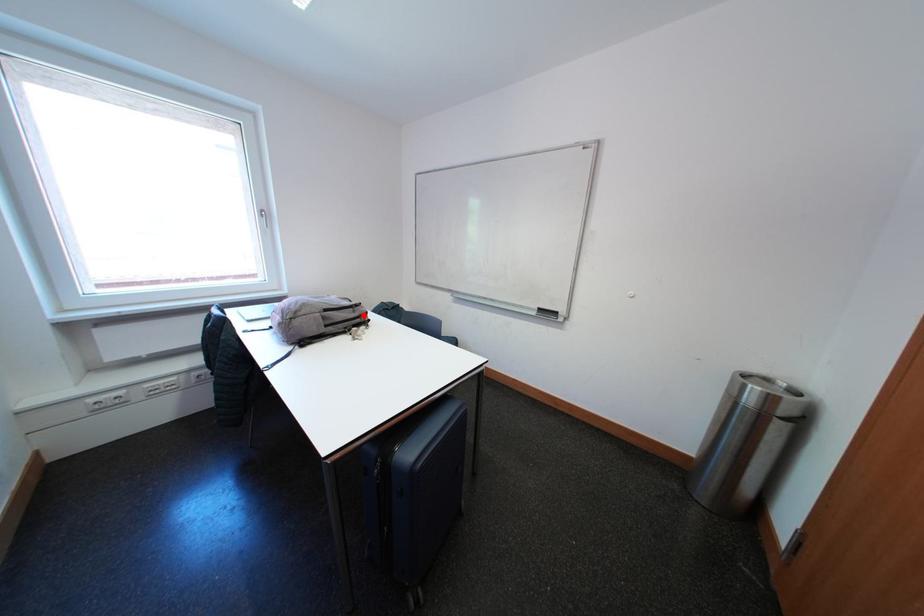
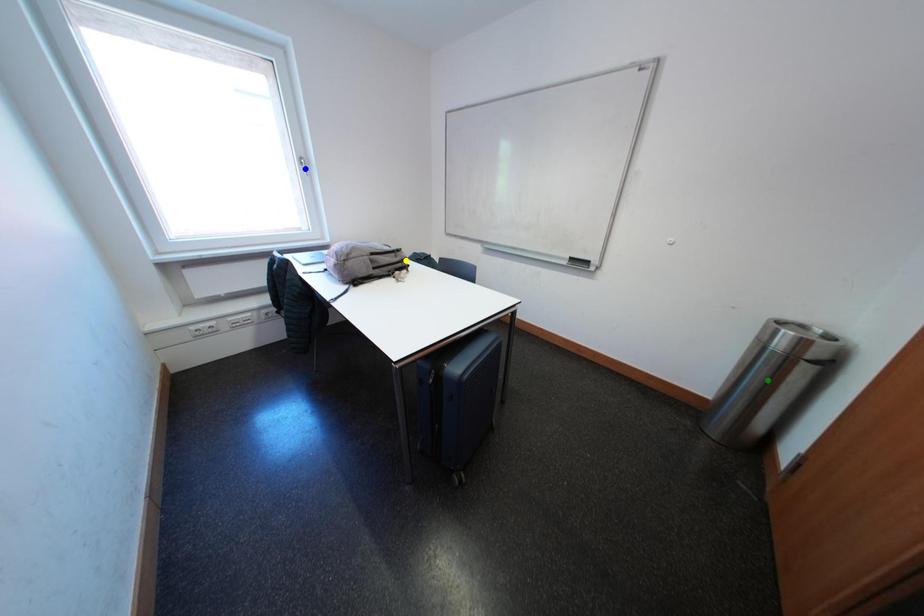
Question: I am providing you with two images of the same scene from different viewpoints. A red point is marked on the first image. You are given multiple points on the second image. Which spot in image 2 lines up with the point in image 1?

Choices:
 (A) blue point
 (B) green point
 (C) yellow point

Answer: (C)